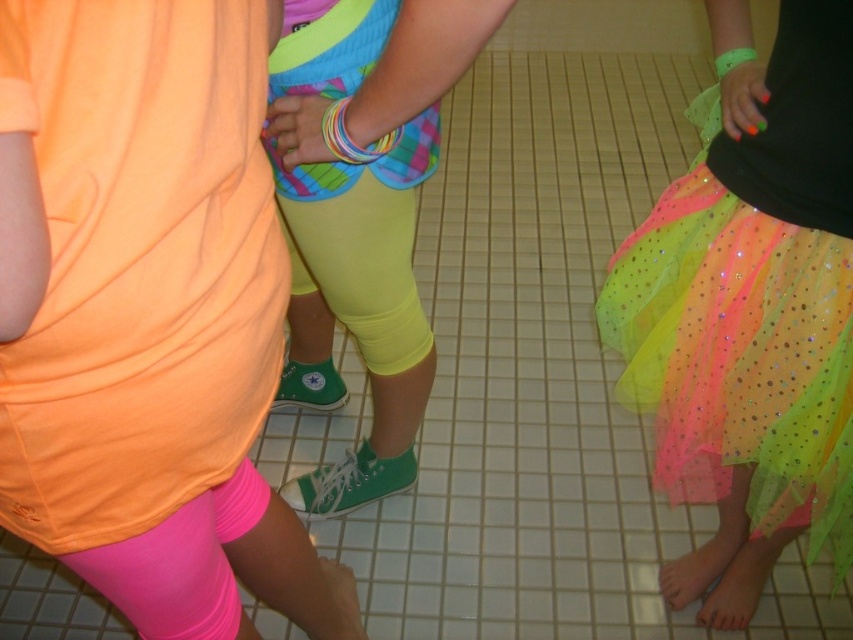
You are a photographer adjusting your camera to focus on the neon yellow spandex at center and the neon tulle skirt at lower right. Which object should you focus on first if you want to capture both clearly in the same frame?

You should focus on the neon yellow spandex at center first because the neon tulle skirt at lower right is positioned under it, meaning the neon yellow spandex is closer to the camera and will require proper focus to ensure both are clear.

Based on the scene described, which object is smaller in size between the neon tulle skirt at lower right and the neon yellow spandex at center?

The neon tulle skirt at lower right has a smaller size compared to the neon yellow spandex at center.

You are a photographer trying to capture a closeup shot of the neon tulle skirt at lower right. Based on the scene description, can you determine if the skirt is within the recommended 16 inches focal length for a macro lens?

The neon tulle skirt at lower right is 15.97 inches away from the viewer, which is just under the recommended 16 inches focal length for a macro lens. Therefore, it can be captured effectively with a macro lens.